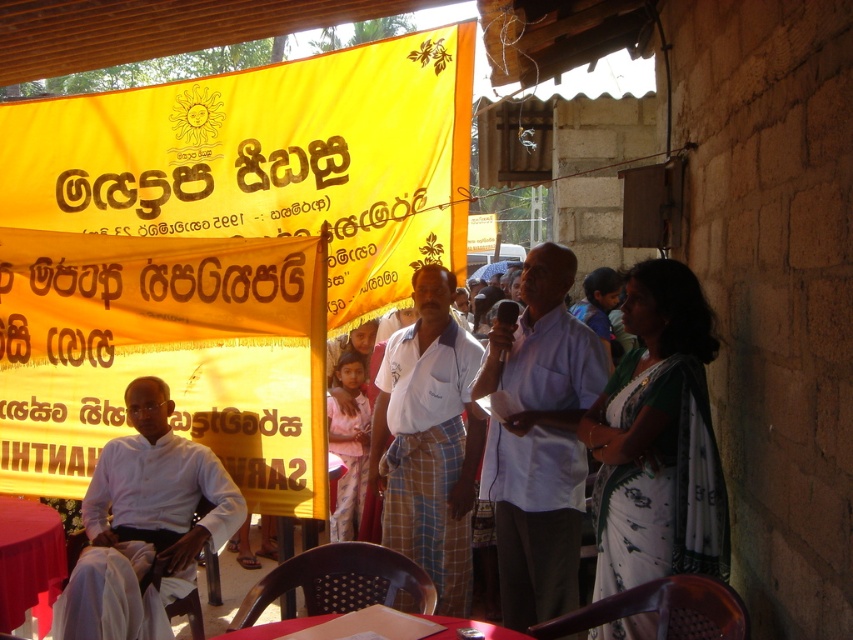
Question: Which point is farther to the camera?

Choices:
 (A) (520, 632)
 (B) (221, 189)
 (C) (38, 564)
 (D) (468, 355)

Answer: (B)

Question: Does white cotton shirt at left appear over smooth red table at lower center?

Choices:
 (A) yes
 (B) no

Answer: (A)

Question: Which object is the farthest from the smooth red table at lower center?

Choices:
 (A) white woven shirt at center
 (B) yellow fabric banner at upper left
 (C) white cotton shirt at left

Answer: (B)

Question: Does yellow fabric banner at upper left have a larger size compared to white cotton shirt at left?

Choices:
 (A) yes
 (B) no

Answer: (A)

Question: Does white cotton shirt at left lie behind smooth red table at lower left?

Choices:
 (A) no
 (B) yes

Answer: (A)

Question: Among these points, which one is farthest from the camera?

Choices:
 (A) (186, 516)
 (B) (437, 621)

Answer: (A)